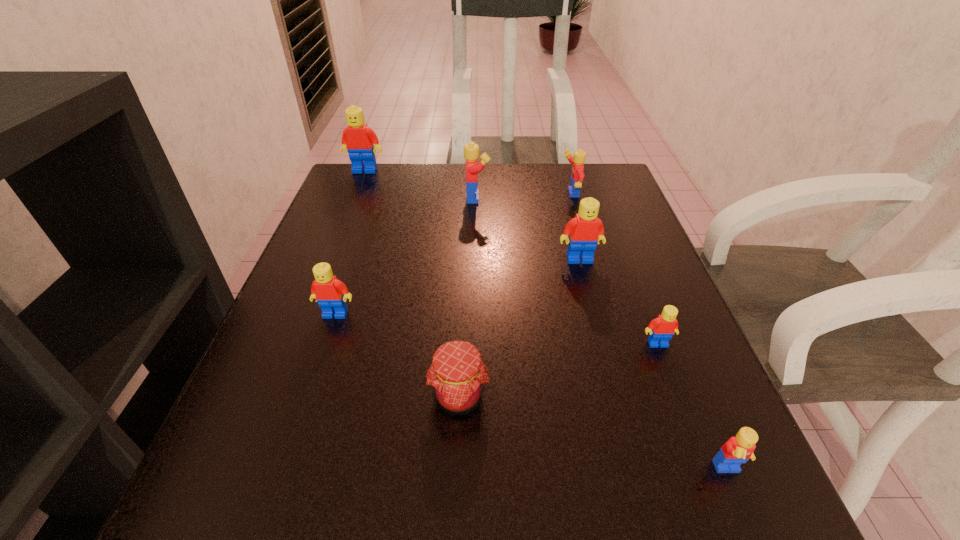
Identify which yellow Lego is the nearest to the second biggest yellow Lego. Please provide its 2D coordinates. Your answer should be formatted as a tuple, i.e. [(x, y)], where the tuple contains the x and y coordinates of a point satisfying the conditions above.

[(471, 150)]

Identify which yellow Lego is the second nearest to the smallest yellow Lego. Please provide its 2D coordinates. Your answer should be formatted as a tuple, i.e. [(x, y)], where the tuple contains the x and y coordinates of a point satisfying the conditions above.

[(471, 150)]